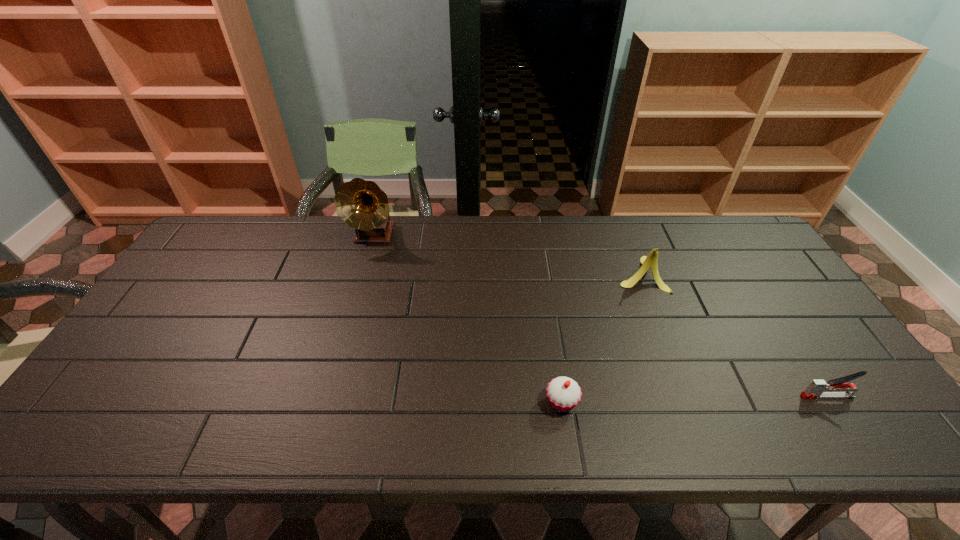
Locate an element on the screen. free space between the shortest object and the banana is located at coordinates (601, 338).

The height and width of the screenshot is (540, 960). Find the location of `vacant space that's between the second farthest object and the stapler`. vacant space that's between the second farthest object and the stapler is located at coordinates (733, 335).

At what (x,y) coordinates should I click in order to perform the action: click on blank region between the phonograph_record and the second object from right to left. Please return your answer as a coordinate pair (x, y). The height and width of the screenshot is (540, 960). Looking at the image, I should click on (508, 255).

Identify the location of the second closest object to the shortest object. This screenshot has height=540, width=960. (817, 388).

Find the location of a particular element. The width and height of the screenshot is (960, 540). object that is the closest to the leftmost object is located at coordinates (563, 393).

Locate an element on the screen. This screenshot has width=960, height=540. vacant region that satisfies the following two spatial constraints: 1. on the horn of the banana; 2. on the right side of the leftmost object is located at coordinates (363, 274).

I want to click on vacant region that satisfies the following two spatial constraints: 1. on the horn of the shortest object; 2. on the right side of the farthest object, so click(x=326, y=402).

This screenshot has width=960, height=540. I want to click on vacant area that satisfies the following two spatial constraints: 1. on the horn of the third object from left to right; 2. on the left side of the leftmost object, so click(363, 274).

You are a GUI agent. You are given a task and a screenshot of the screen. Output one action in this format:
    pyautogui.click(x=<x>, y=<y>)
    Task: Click on the free point that satisfies the following two spatial constraints: 1. on the back side of the second farthest object; 2. on the right side of the second object from left to right
    The image size is (960, 540).
    Given the screenshot: What is the action you would take?
    pyautogui.click(x=542, y=274)

This screenshot has height=540, width=960. What are the coordinates of `free space that satisfies the following two spatial constraints: 1. on the horn of the banana; 2. on the left side of the farthest object` in the screenshot? It's located at (363, 274).